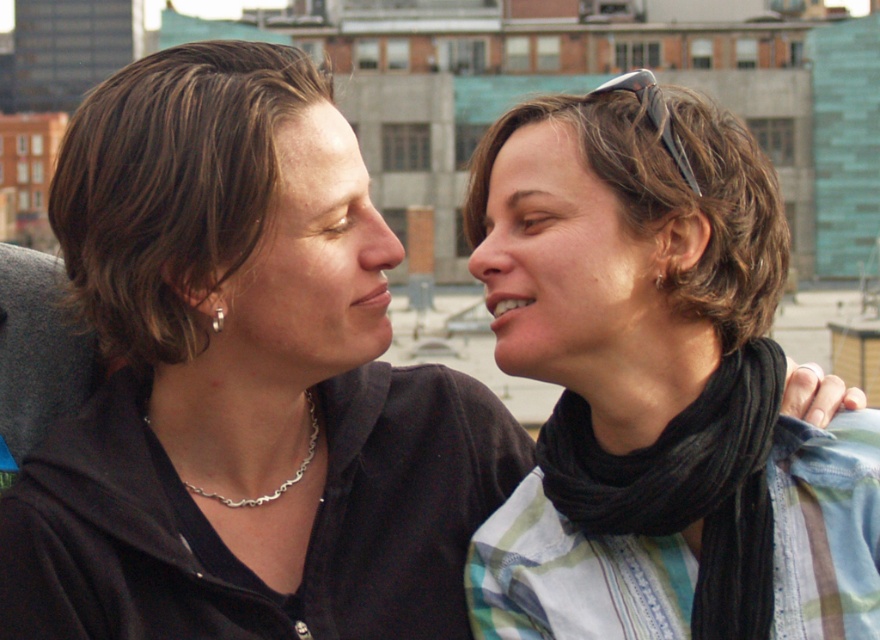
Question: Which object is positioned closest to the silver chain necklace at center?

Choices:
 (A) dark brown hair at center
 (B) brown matte hair at upper right
 (C) black scarf at upper right

Answer: (A)

Question: Does dark brown hair at center appear over brown matte hair at upper right?

Choices:
 (A) yes
 (B) no

Answer: (B)

Question: Which point is closer to the camera?

Choices:
 (A) (114, 348)
 (B) (688, 115)
 (C) (151, 448)
 (D) (510, 342)

Answer: (C)

Question: Does dark brown hair at center appear on the left side of brown matte hair at upper right?

Choices:
 (A) yes
 (B) no

Answer: (A)

Question: Considering the real-world distances, which object is closest to the dark brown hair at center?

Choices:
 (A) silver chain necklace at center
 (B) black scarf at upper right

Answer: (A)

Question: Does dark brown hair at center have a larger size compared to silver chain necklace at center?

Choices:
 (A) no
 (B) yes

Answer: (B)